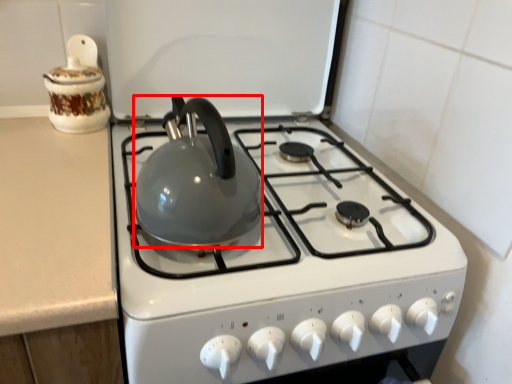
Question: From the image's perspective, where is kettle (annotated by the red box) located in relation to kitchen appliance in the image?

Choices:
 (A) above
 (B) below

Answer: (B)